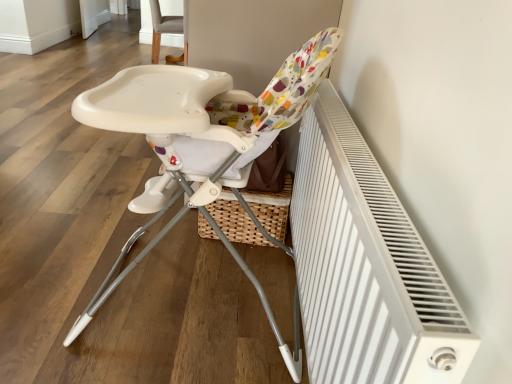
In order to face gray fabric chair at upper center, the 1th chair from the back, should I rotate leftwards or rightwards?

It's best to rotate left around 12.226 degrees.

Measure the distance between point (382, 375) and camera.

Point (382, 375) is 62.90 centimeters from camera.

Find the location of `white plastic highchair at center, positioned as the first chair in front-to-back order`. white plastic highchair at center, positioned as the first chair in front-to-back order is located at coordinates (200, 140).

Is gray fabric chair at upper center, the second chair from the front, not within white textured radiator at right?

gray fabric chair at upper center, the second chair from the front, is positioned outside white textured radiator at right.

Which object is thinner, gray fabric chair at upper center, the 1th chair from the back, or white textured radiator at right?

Thinner between the two is white textured radiator at right.

Considering the points (177, 25) and (304, 169), which point is behind, point (177, 25) or point (304, 169)?

Point (177, 25)

Considering the positions of objects gray fabric chair at upper center, the second chair from the front, and white textured radiator at right in the image provided, who is more to the left, gray fabric chair at upper center, the second chair from the front, or white textured radiator at right?

gray fabric chair at upper center, the second chair from the front.

Which is more distant, (326, 49) or (334, 244)?

The point (326, 49) is farther from the camera.

Can you confirm if white plastic highchair at center, positioned as the first chair in front-to-back order, is shorter than white textured radiator at right?

Yes.

Is white plastic highchair at center, positioned as the first chair in front-to-back order, aimed at white textured radiator at right?

No.

Considering the sizes of white plastic highchair at center, positioned as the first chair in front-to-back order, and white textured radiator at right in the image, is white plastic highchair at center, positioned as the first chair in front-to-back order, wider or thinner than white textured radiator at right?

In the image, white plastic highchair at center, positioned as the first chair in front-to-back order, appears to be wider than white textured radiator at right.

How different are the orientations of gray fabric chair at upper center, the second chair from the front, and white plastic highchair at center, positioned as the first chair in front-to-back order, in degrees?

72 degrees separate the facing orientations of gray fabric chair at upper center, the second chair from the front, and white plastic highchair at center, positioned as the first chair in front-to-back order.

In the scene shown: Considering the relative sizes of gray fabric chair at upper center, the 1th chair from the back, and white plastic highchair at center, the 2th chair from the back, in the image provided, is gray fabric chair at upper center, the 1th chair from the back, bigger than white plastic highchair at center, the 2th chair from the back,?

Incorrect, gray fabric chair at upper center, the 1th chair from the back, is not larger than white plastic highchair at center, the 2th chair from the back.

Is gray fabric chair at upper center, the second chair from the front, spatially inside white plastic highchair at center, positioned as the first chair in front-to-back order, or outside of it?

gray fabric chair at upper center, the second chair from the front, is spatially situated outside white plastic highchair at center, positioned as the first chair in front-to-back order.

Between point (157, 22) and point (137, 95), which one is positioned in front?

Point (137, 95)

Is white textured radiator at right outside of gray fabric chair at upper center, the second chair from the front?

Yes, white textured radiator at right is not within gray fabric chair at upper center, the second chair from the front.

Relative to gray fabric chair at upper center, the second chair from the front, is white textured radiator at right in front or behind?

white textured radiator at right is positioned closer to the viewer than gray fabric chair at upper center, the second chair from the front.

Find the location of `radiator located on the right of gray fabric chair at upper center, the second chair from the front`. radiator located on the right of gray fabric chair at upper center, the second chair from the front is located at coordinates (366, 267).

Does white textured radiator at right have a greater height compared to gray fabric chair at upper center, the 1th chair from the back?

No.

From a real-world perspective, which object rests below the other?

white plastic highchair at center, positioned as the first chair in front-to-back order, from a real-world perspective.

Is white textured radiator at right oriented towards white plastic highchair at center, positioned as the first chair in front-to-back order?

No, white textured radiator at right is not turned towards white plastic highchair at center, positioned as the first chair in front-to-back order.

This screenshot has height=384, width=512. Find the location of `radiator lying in front of the white plastic highchair at center, the 2th chair from the back`. radiator lying in front of the white plastic highchair at center, the 2th chair from the back is located at coordinates (366, 267).

From the image's perspective, is white textured radiator at right over white plastic highchair at center, positioned as the first chair in front-to-back order?

No, from the image's perspective, white textured radiator at right is not on top of white plastic highchair at center, positioned as the first chair in front-to-back order.

In the image, is white plastic highchair at center, positioned as the first chair in front-to-back order, on the left side or the right side of gray fabric chair at upper center, the 1th chair from the back?

white plastic highchair at center, positioned as the first chair in front-to-back order, is positioned on gray fabric chair at upper center, the 1th chair from the back,'s left side.

Looking at this image, how different are the orientations of white plastic highchair at center, positioned as the first chair in front-to-back order, and gray fabric chair at upper center, the second chair from the front, in degrees?

They differ by 72 degrees in their facing directions.

From the image's perspective, is white plastic highchair at center, positioned as the first chair in front-to-back order, located beneath gray fabric chair at upper center, the second chair from the front?

Yes.

The width and height of the screenshot is (512, 384). In order to click on chair that is the 2nd object located above the white textured radiator at right (from the image's perspective) in this screenshot , I will do `click(168, 31)`.

In order to click on radiator in front of the white plastic highchair at center, positioned as the first chair in front-to-back order in this screenshot , I will do pyautogui.click(x=366, y=267).

Based on their spatial positions, is gray fabric chair at upper center, the second chair from the front, or white plastic highchair at center, positioned as the first chair in front-to-back order, closer to white textured radiator at right?

Based on the image, white plastic highchair at center, positioned as the first chair in front-to-back order, appears to be nearer to white textured radiator at right.

Based on their spatial positions, is white plastic highchair at center, the 2th chair from the back, or gray fabric chair at upper center, the second chair from the front, closer to white textured radiator at right?

white plastic highchair at center, the 2th chair from the back, is positioned closer to the anchor white textured radiator at right.

Consider the image. Looking at the image, which one is located further to gray fabric chair at upper center, the 1th chair from the back, white textured radiator at right or white plastic highchair at center, positioned as the first chair in front-to-back order?

white textured radiator at right.

Considering their positions, is gray fabric chair at upper center, the 1th chair from the back, positioned further to white plastic highchair at center, positioned as the first chair in front-to-back order, than white textured radiator at right?

gray fabric chair at upper center, the 1th chair from the back.

When comparing their distances from gray fabric chair at upper center, the 1th chair from the back, does white plastic highchair at center, positioned as the first chair in front-to-back order, or white textured radiator at right seem further?

Based on the image, white textured radiator at right appears to be further to gray fabric chair at upper center, the 1th chair from the back.

Estimate the real-world distances between objects in this image. Which object is further from white plastic highchair at center, positioned as the first chair in front-to-back order, white textured radiator at right or gray fabric chair at upper center, the second chair from the front?

The object further to white plastic highchair at center, positioned as the first chair in front-to-back order, is gray fabric chair at upper center, the second chair from the front.

Image resolution: width=512 pixels, height=384 pixels. Find the location of `chair between white textured radiator at right and gray fabric chair at upper center, the second chair from the front, from front to back`. chair between white textured radiator at right and gray fabric chair at upper center, the second chair from the front, from front to back is located at coordinates (200, 140).